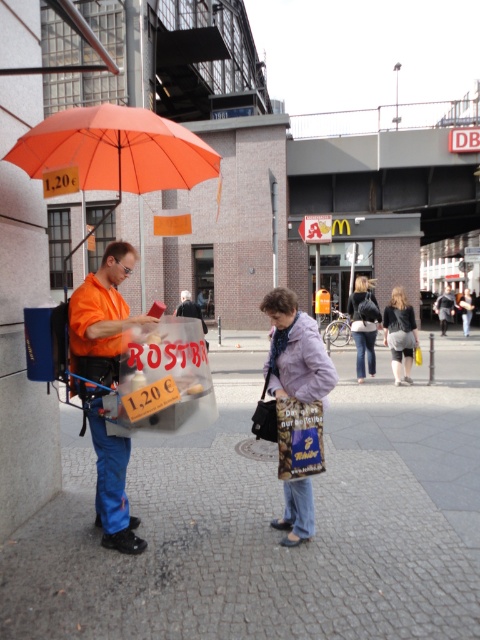
Does orange matte umbrella at left lie behind orange fabric umbrella at left?

No.

The image size is (480, 640). I want to click on orange matte umbrella at left, so click(117, 148).

Between point (303, 349) and point (360, 278), which one is positioned behind?

Positioned behind is point (360, 278).

From the picture: Can you confirm if purple fabric bag at center is taller than denim jacket at center?

Indeed, purple fabric bag at center has a greater height compared to denim jacket at center.

Does point (320, 364) come closer to viewer compared to point (361, 276)?

Yes, point (320, 364) is in front of point (361, 276).

Locate an element on the screen. This screenshot has height=640, width=480. purple fabric bag at center is located at coordinates (296, 349).

Between purple fabric bag at center and orange fabric umbrella at upper left, which one appears on the right side from the viewer's perspective?

From the viewer's perspective, orange fabric umbrella at upper left appears more on the right side.

I want to click on purple fabric bag at center, so click(296, 349).

The image size is (480, 640). What are the coordinates of `purple fabric bag at center` in the screenshot? It's located at (296, 349).